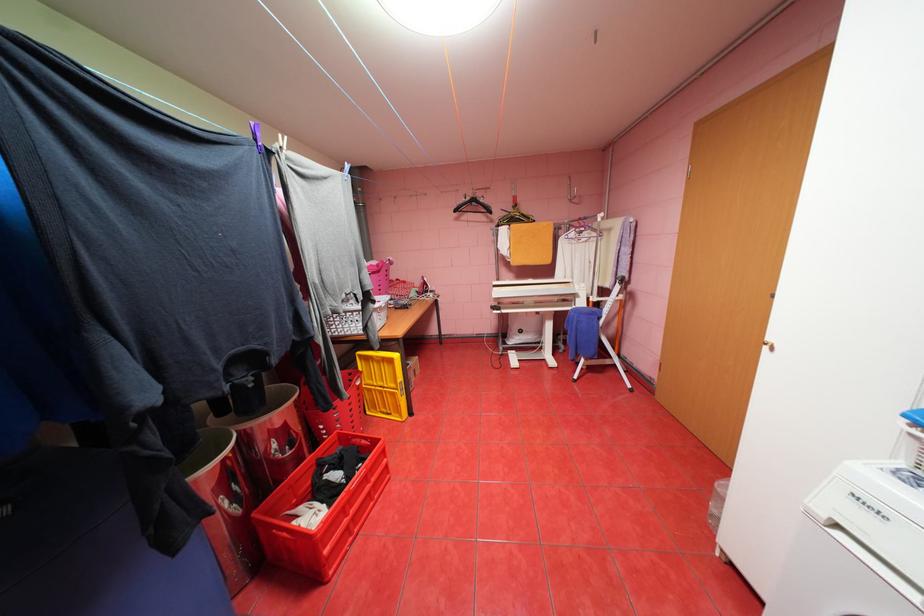
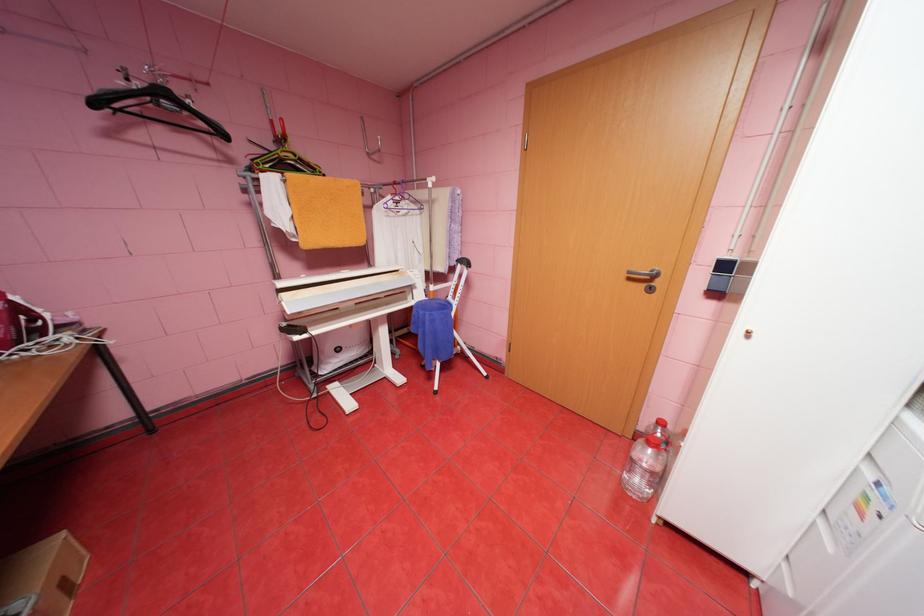
Locate, in the second image, the point that corresponds to pixel 464 209 in the first image.

(103, 103)